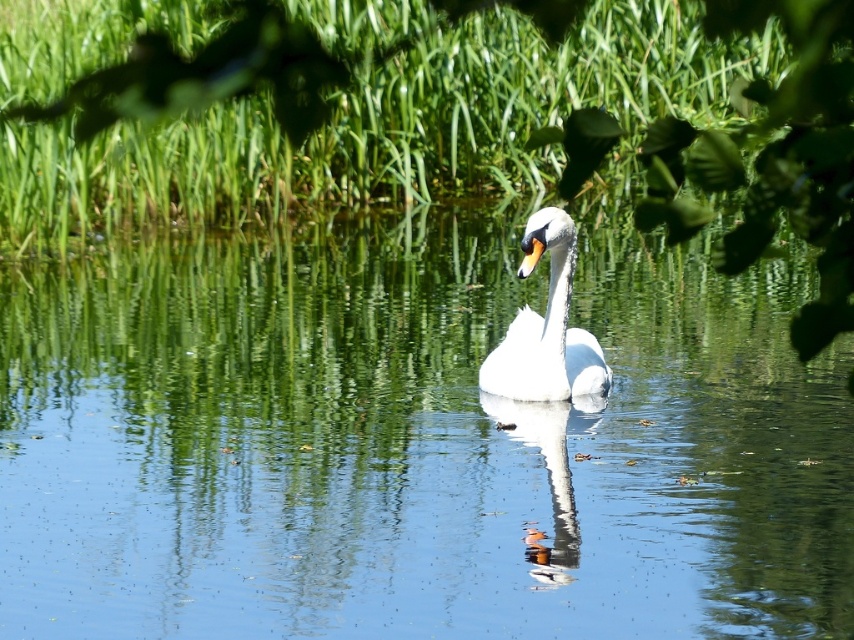
You are a photographer trying to capture the reflection of the white glossy swan at center in the clear water at center. The camera you are using has a depth of field that can focus on objects within a 2.5 meter range. Will you be able to capture both the swan and its reflection clearly in the same shot?

The clear water at center and white glossy swan at center are 2.63 meters apart from each other. Since the camera can focus within a 2.5 meter range, the distance between them exceeds the camera limit, so you cannot capture both the swan and its reflection clearly in the same shot.

You are a bird flying over the scene. You want to land on the clear water at center. Is the point at coordinates point (413, 444) on the clear water at center?

Yes, the point (413, 444) is on the clear water at center.

You are a photographer aiming to capture the white glossy swan at center without the clear water at center obstructing the view. Can you adjust your position to achieve this?

The clear water at center is closer to you than the white glossy swan at center, so moving your camera position slightly upward or backward might help to avoid the water obstructing the view of the swan.